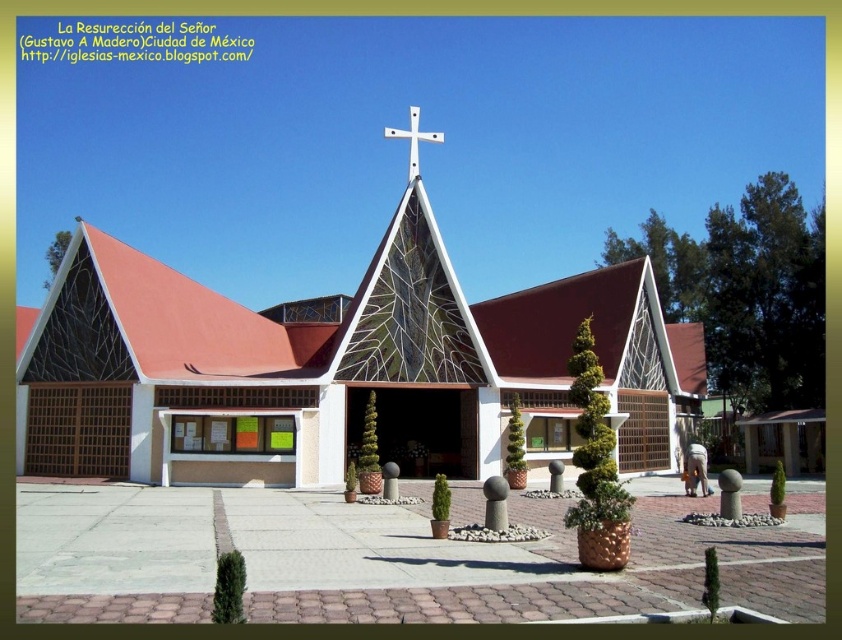
Question: Among these objects, which one is farthest from the camera?

Choices:
 (A) white metallic cross at center
 (B) white glass church at center

Answer: (A)

Question: Which point is farther from the camera taking this photo?

Choices:
 (A) (435, 134)
 (B) (99, 294)

Answer: (A)

Question: Among these points, which one is nearest to the camera?

Choices:
 (A) [x=413, y=156]
 (B) [x=617, y=381]

Answer: (A)

Question: Can you confirm if white glass church at center is positioned to the left of white metallic cross at center?

Choices:
 (A) no
 (B) yes

Answer: (B)

Question: Can you confirm if white glass church at center is wider than white metallic cross at center?

Choices:
 (A) yes
 (B) no

Answer: (A)

Question: Is white glass church at center below white metallic cross at center?

Choices:
 (A) no
 (B) yes

Answer: (B)